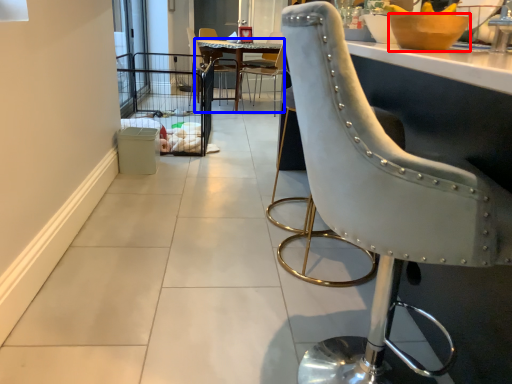
Question: Which of the following is the farthest to the observer, bowl (highlighted by a red box) or kitchen & dining room table (highlighted by a blue box)?

Choices:
 (A) bowl
 (B) kitchen & dining room table

Answer: (B)